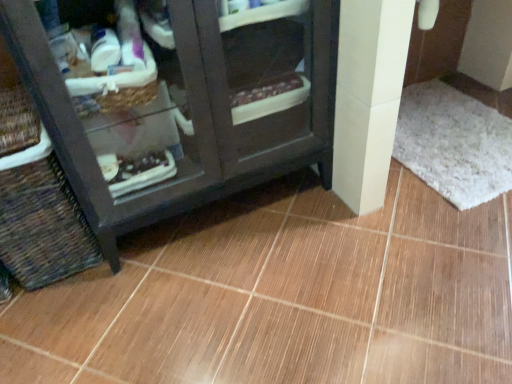
Question: From the image's perspective, is woven brown basket at lower left located beneath white shaggy bath mat at lower right?

Choices:
 (A) no
 (B) yes

Answer: (B)

Question: Is woven brown basket at lower left at the left side of white shaggy bath mat at lower right?

Choices:
 (A) yes
 (B) no

Answer: (A)

Question: Is woven brown basket at lower left smaller than white shaggy bath mat at lower right?

Choices:
 (A) no
 (B) yes

Answer: (A)

Question: Considering the relative sizes of woven brown basket at lower left and white shaggy bath mat at lower right in the image provided, is woven brown basket at lower left taller than white shaggy bath mat at lower right?

Choices:
 (A) no
 (B) yes

Answer: (B)

Question: Is woven brown basket at lower left positioned with its back to white shaggy bath mat at lower right?

Choices:
 (A) yes
 (B) no

Answer: (B)

Question: Does woven brown basket at lower left have a larger size compared to white shaggy bath mat at lower right?

Choices:
 (A) no
 (B) yes

Answer: (B)

Question: Is brown glossy tile at center at the right side of woven brown basket at lower left?

Choices:
 (A) no
 (B) yes

Answer: (B)

Question: Can you confirm if brown glossy tile at center is thinner than woven brown basket at lower left?

Choices:
 (A) no
 (B) yes

Answer: (A)

Question: From the image's perspective, is brown glossy tile at center located beneath woven brown basket at lower left?

Choices:
 (A) yes
 (B) no

Answer: (A)

Question: Is brown glossy tile at center looking in the opposite direction of woven brown basket at lower left?

Choices:
 (A) no
 (B) yes

Answer: (A)

Question: Is brown glossy tile at center next to woven brown basket at lower left?

Choices:
 (A) yes
 (B) no

Answer: (B)

Question: Does brown glossy tile at center come behind woven brown basket at lower left?

Choices:
 (A) yes
 (B) no

Answer: (B)

Question: From a real-world perspective, is white shaggy bath mat at lower right over woven brown basket at lower left?

Choices:
 (A) yes
 (B) no

Answer: (B)